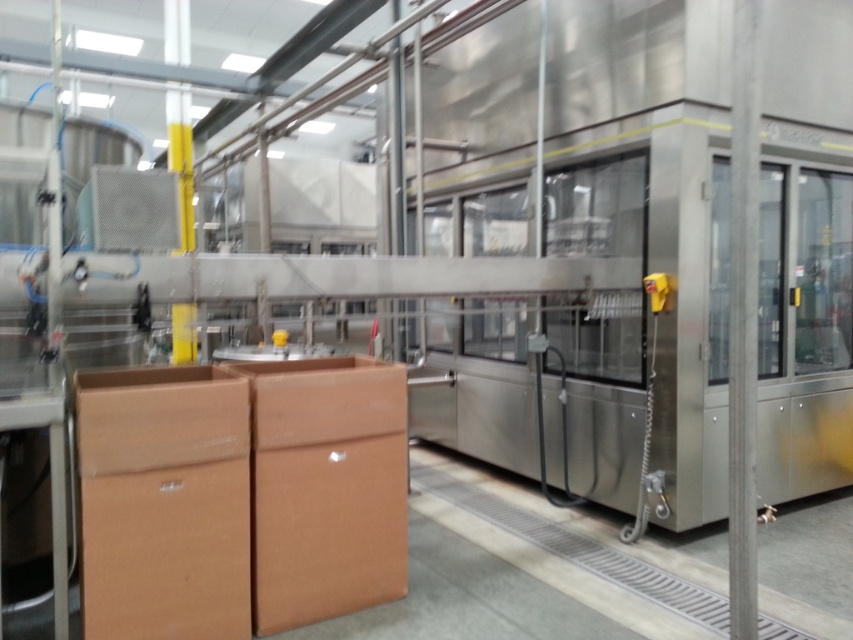
Does brown cardboard box at left appear on the left side of metallic silver sink at center?

No, brown cardboard box at left is not to the left of metallic silver sink at center.

Which is more to the right, brown cardboard box at left or metallic silver sink at center?

Positioned to the right is brown cardboard box at left.

Is point (242, 476) positioned in front of point (299, 353)?

Yes, it is.

The image size is (853, 640). I want to click on brown cardboard box at left, so click(164, 502).